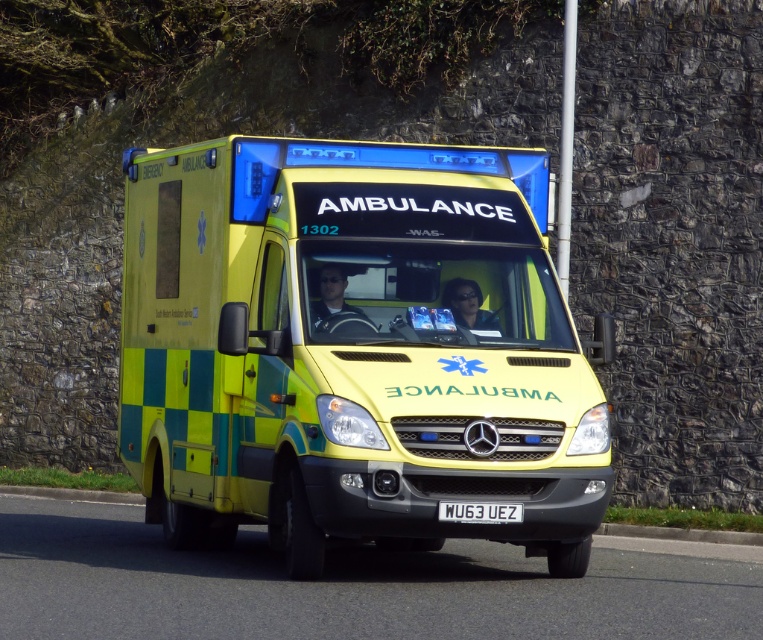
Question: Which object is farther from the camera taking this photo?

Choices:
 (A) white plastic license plate at center
 (B) matte black sunglasses at center

Answer: (B)

Question: Where is matte black helmet at center located in relation to white plastic license plate at center in the image?

Choices:
 (A) right
 (B) left

Answer: (B)

Question: Observing the image, what is the correct spatial positioning of matte black sunglasses at center in reference to white plastic license plate at center?

Choices:
 (A) above
 (B) below

Answer: (A)

Question: Which point is farther to the camera?

Choices:
 (A) (359, 316)
 (B) (478, 323)
 (C) (510, 509)
 (D) (488, 176)

Answer: (D)

Question: Which point appears closest to the camera in this image?

Choices:
 (A) (452, 301)
 (B) (439, 513)
 (C) (243, 332)

Answer: (B)

Question: Does matte black sunglasses at center have a lesser width compared to white plastic license plate at center?

Choices:
 (A) yes
 (B) no

Answer: (A)